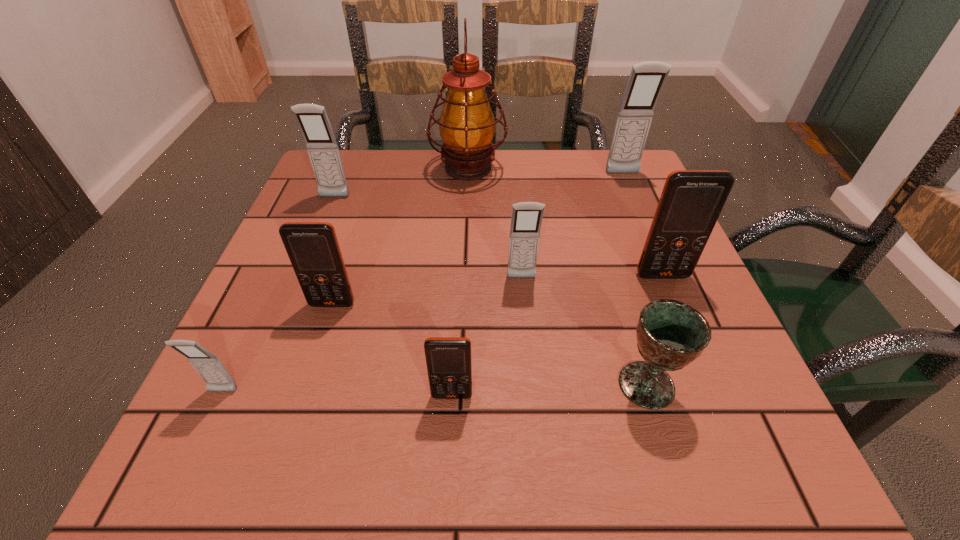
At what (x,y) coordinates should I click in order to perform the action: click on orange cellular telephone that is the closest one to the third cellular telephone from right to left. Please return your answer as a coordinate pair (x, y). The image size is (960, 540). Looking at the image, I should click on (691, 201).